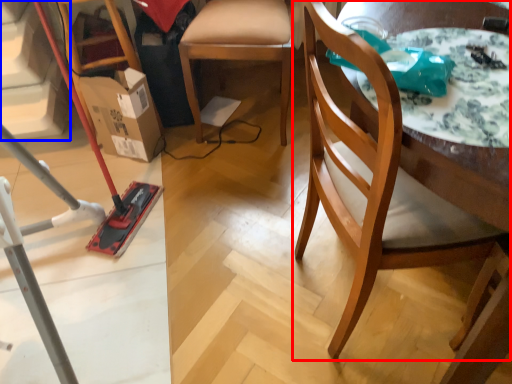
Question: Which point is further to the camera, chair (highlighted by a red box) or stairwell (highlighted by a blue box)?

Choices:
 (A) chair
 (B) stairwell

Answer: (B)